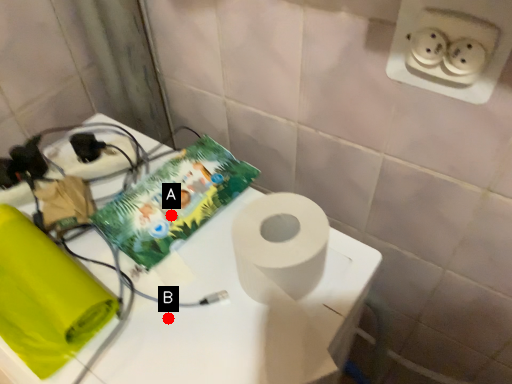
Question: Two points are circled on the image, labeled by A and B beside each circle. Which point appears farthest from the camera in this image?

Choices:
 (A) A is further
 (B) B is further

Answer: (A)